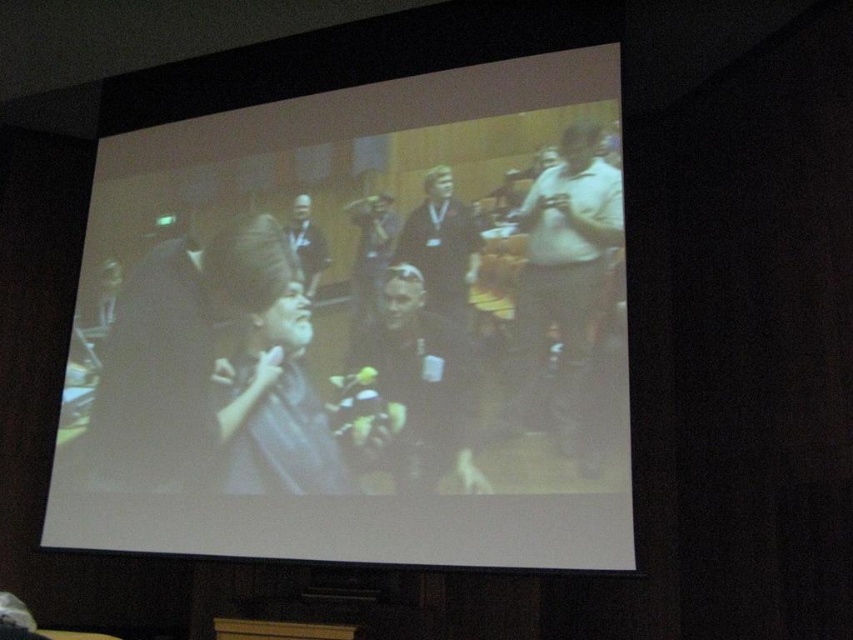
Question: Which point is farther from the camera taking this photo?

Choices:
 (A) (289, 282)
 (B) (506, 413)

Answer: (A)

Question: Does matte black laptop at center appear on the left side of dark gray shirt at center?

Choices:
 (A) no
 (B) yes

Answer: (A)

Question: Which point is closer to the camera taking this photo?

Choices:
 (A) (309, 218)
 (B) (428, 512)
 (C) (590, 289)
 (D) (444, 337)

Answer: (C)

Question: Among these objects, which one is nearest to the camera?

Choices:
 (A) matte black laptop at center
 (B) dark gray shirt at center

Answer: (A)

Question: Does dark gray shirt at center have a lesser width compared to matte black shirt at center?

Choices:
 (A) yes
 (B) no

Answer: (B)

Question: In this image, where is white matte shirt at center located relative to dark gray suit at center?

Choices:
 (A) below
 (B) above

Answer: (A)